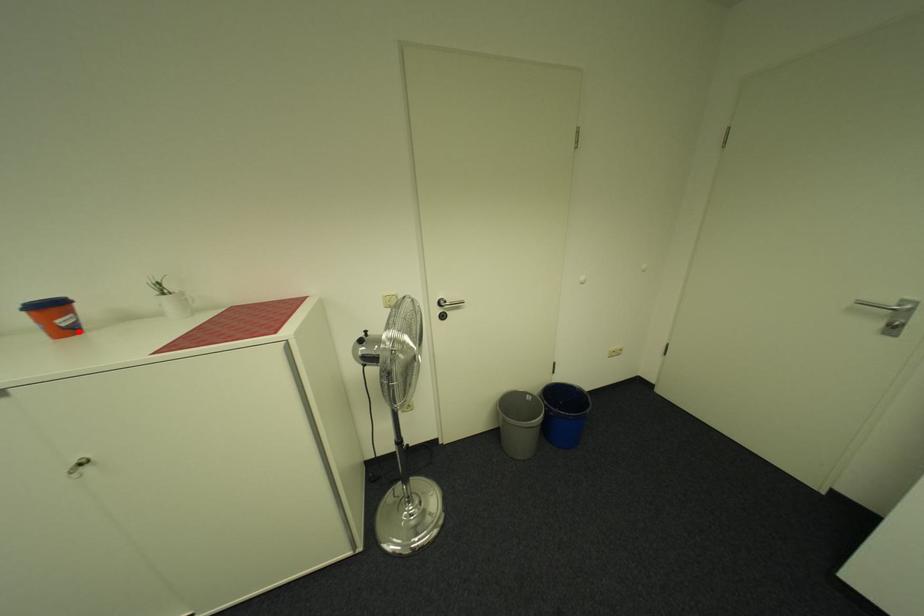
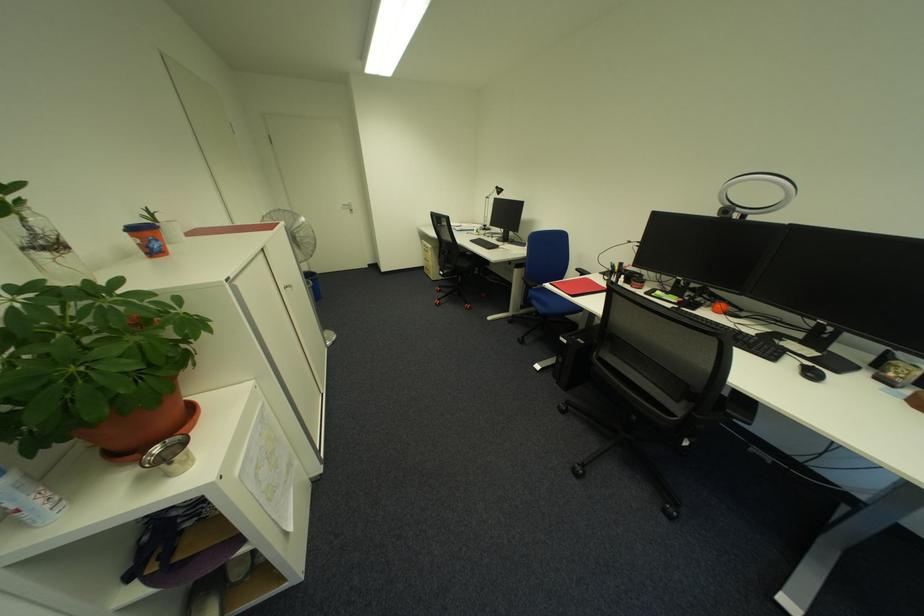
Locate, in the second image, the point that corresponds to the highlighted location in the first image.

(164, 254)